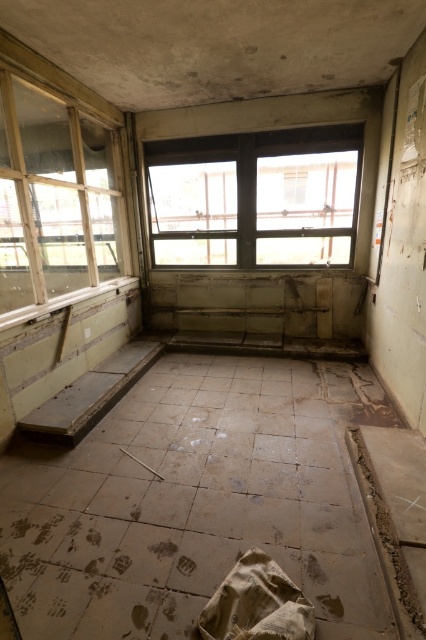
Which is more to the left, transparent glass window at center or transparent glass window at left?

transparent glass window at left

Is transparent glass window at center taller than transparent glass window at left?

No.

Where is `transparent glass window at center`? The image size is (426, 640). transparent glass window at center is located at coordinates (256, 196).

Where is `transparent glass window at center`? transparent glass window at center is located at coordinates coord(256,196).